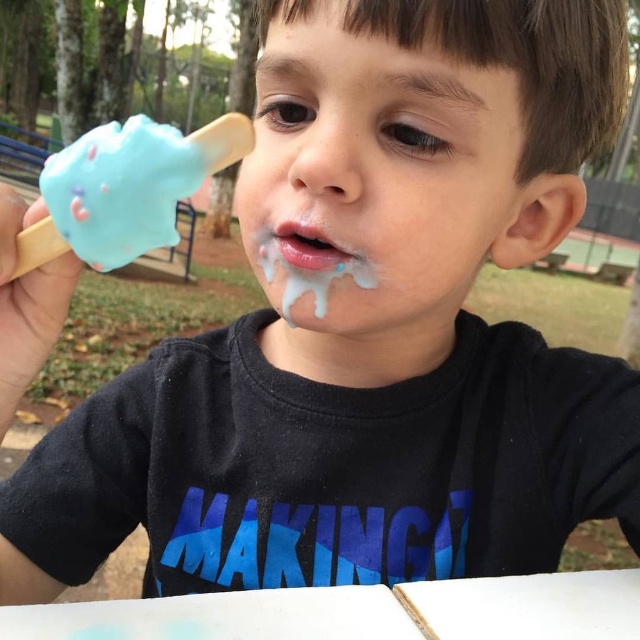
You are a photographer trying to capture the child enjoying their ice cream. To ensure the blue matte ice cream cone at left and white matte lips at center are both in focus, which object should you adjust your camera focus on first?

The blue matte ice cream cone at left is taller than the white matte lips at center, so you should focus on the blue matte ice cream cone at left first to ensure both are in focus.

You are a photographer positioned at the park and want to take a closeup shot of the blue matte ice cream cone at left. If your camera can focus on objects within 25 cm, will it be able to capture the cone clearly?

The blue matte ice cream cone at left is 24.19 centimeters away from the viewer, which is within the camera focus range of 25 cm. Therefore, the camera can capture the cone clearly.

You are a photographer standing at a certain distance from the child holding the matte blue ice cream at center. You want to take a closeup shot of the ice cream without any distortion. Given that the recommended distance for distortionless photography is between 12 to 15 inches, can you achieve this by staying at your current position?

The matte blue ice cream at center is 13.76 inches from camera, which falls within the recommended distance range of 12 to 15 inches. Therefore, you can take a closeup shot without distortion by staying at your current position.